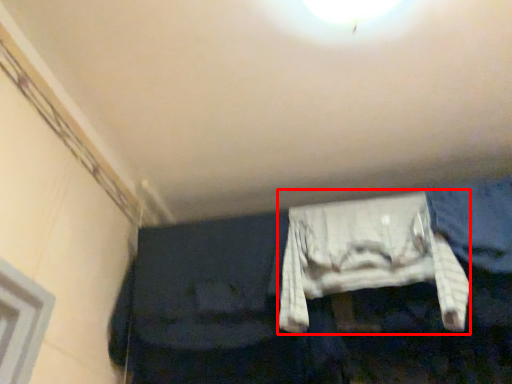
Question: Observing the image, what is the correct spatial positioning of clothing (annotated by the red box) in reference to jeans?

Choices:
 (A) left
 (B) right

Answer: (A)